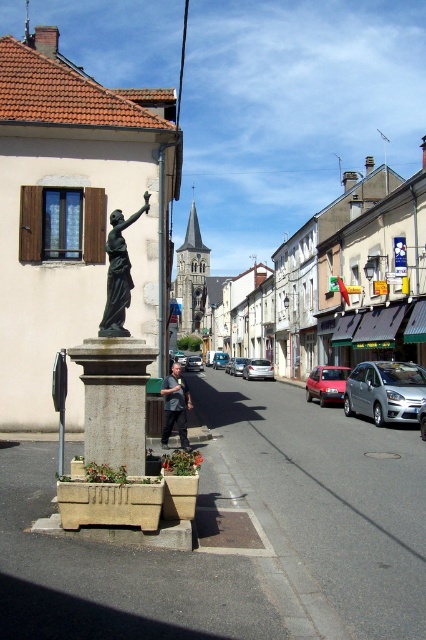
You are a delivery driver who needs to park your truck, which is 10 feet wide, between the matte red car at center and the satin silver car at center. Based on the scene, can your truck fit in the space between them?

The matte red car at center has a larger size compared to satin silver car at center. However, without knowing the exact distance between them, it is impossible to determine if the truck can fit. Please check the available space between the two cars before attempting to park.

You are standing at the statue in the center of the town square. You need to park your matte red car at center in a spot that is exactly 0.6 meters to the right and 0.8 meters forward from the statue base. Is there enough space for the car to fit there?

The matte red car at center is located at point coordinates (327, 384). Since the parking spot is 0.6 meters to the right and 0.8 meters forward from the statue base, the car can be parked there as the coordinates align with the required position.